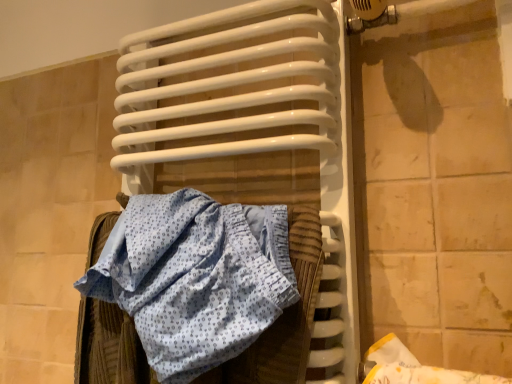
Question: Can you confirm if blue printed fabric at center is positioned to the left of white glossy radiator at center?

Choices:
 (A) yes
 (B) no

Answer: (A)

Question: Is blue printed fabric at center positioned beyond the bounds of white glossy radiator at center?

Choices:
 (A) yes
 (B) no

Answer: (B)

Question: From a real-world perspective, is blue printed fabric at center positioned over white glossy radiator at center based on gravity?

Choices:
 (A) yes
 (B) no

Answer: (B)

Question: Can you confirm if blue printed fabric at center is thinner than white glossy radiator at center?

Choices:
 (A) no
 (B) yes

Answer: (A)

Question: Does blue printed fabric at center lie in front of white glossy radiator at center?

Choices:
 (A) yes
 (B) no

Answer: (A)

Question: Can you confirm if blue printed fabric at center is bigger than white glossy radiator at center?

Choices:
 (A) no
 (B) yes

Answer: (A)

Question: Could you tell me if white glossy radiator at center is facing blue printed fabric at center?

Choices:
 (A) no
 (B) yes

Answer: (B)

Question: Can you confirm if white glossy radiator at center is taller than blue printed fabric at center?

Choices:
 (A) yes
 (B) no

Answer: (A)

Question: Is white glossy radiator at center looking in the opposite direction of blue printed fabric at center?

Choices:
 (A) no
 (B) yes

Answer: (B)

Question: Is white glossy radiator at center smaller than blue printed fabric at center?

Choices:
 (A) yes
 (B) no

Answer: (B)

Question: Is white glossy radiator at center bigger than blue printed fabric at center?

Choices:
 (A) yes
 (B) no

Answer: (A)

Question: Is the position of white glossy radiator at center more distant than that of blue printed fabric at center?

Choices:
 (A) yes
 (B) no

Answer: (A)

Question: From a real-world perspective, is white glossy radiator at center physically located above or below blue printed fabric at center?

Choices:
 (A) below
 (B) above

Answer: (B)